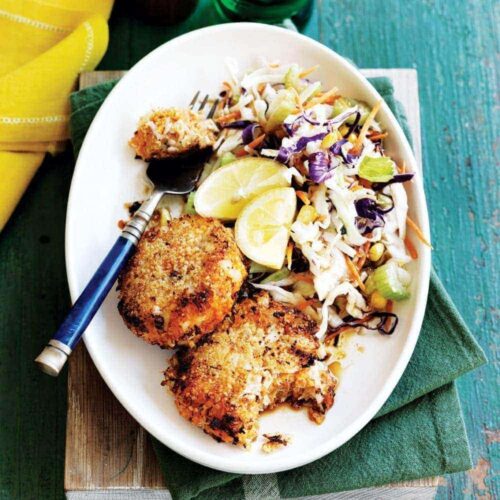
I want to click on turquoise wooden table, so pos(464,207).